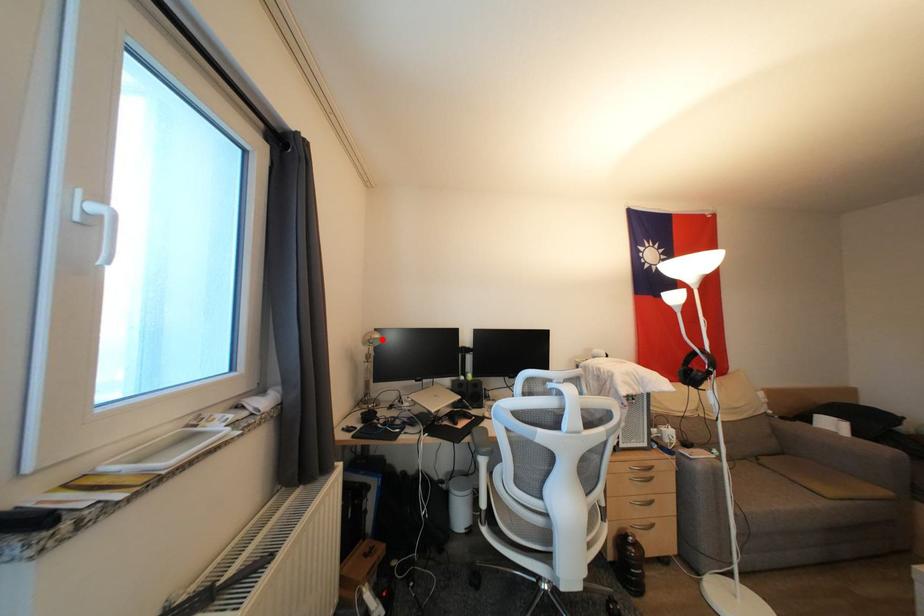
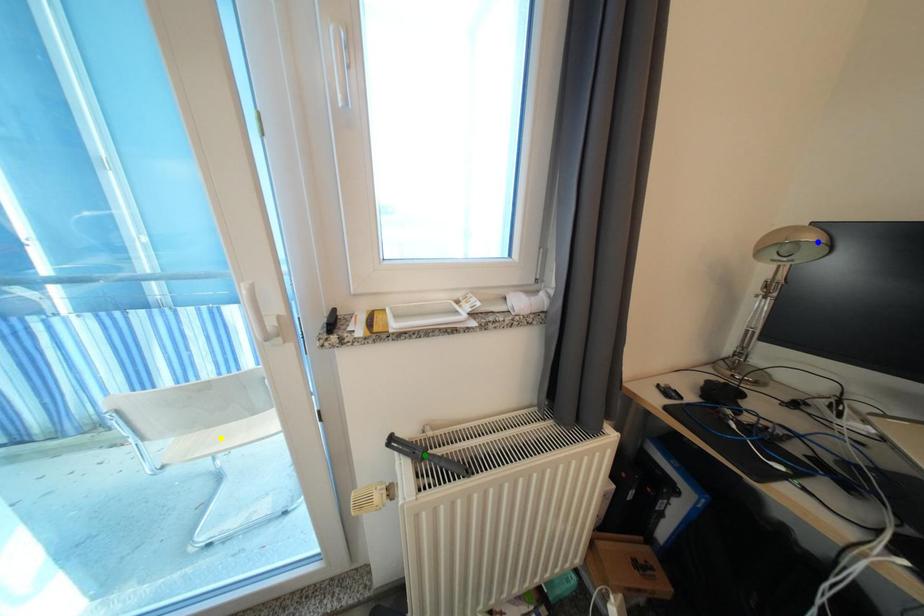
Question: I am providing you with two images of the same scene from different viewpoints. A red point is marked on the first image. You are given multiple points on the second image. Can you choose the point in image 2 that corresponds to the point in image 1?

Choices:
 (A) yellow point
 (B) blue point
 (C) green point

Answer: (B)